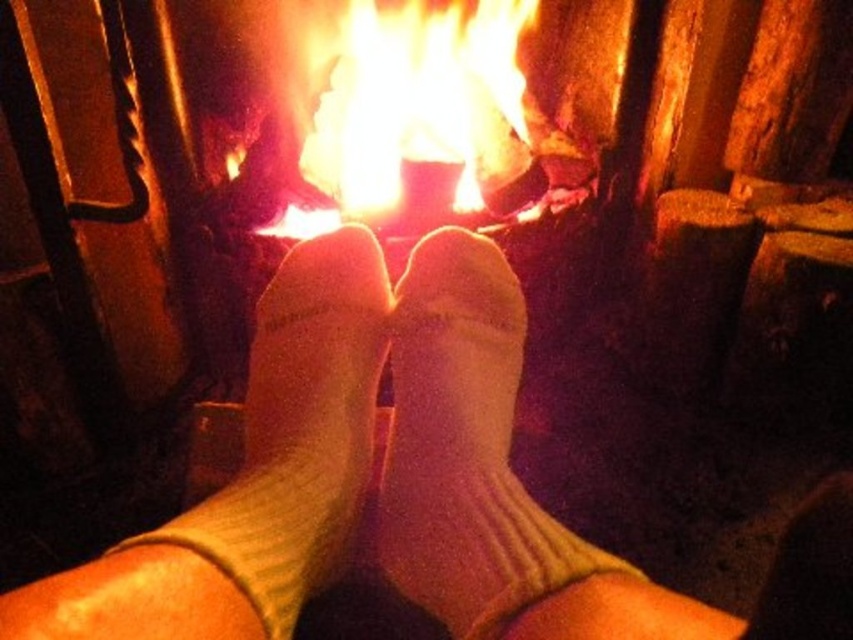
Question: Considering the real-world distances, which object is farthest from the white knit socks at center?

Choices:
 (A) white ribbed sock at center
 (B) white ribbed socks at center

Answer: (A)

Question: Is white ribbed socks at center positioned before white ribbed sock at center?

Choices:
 (A) no
 (B) yes

Answer: (B)

Question: Can you confirm if white ribbed socks at center is wider than white ribbed sock at center?

Choices:
 (A) yes
 (B) no

Answer: (A)

Question: Does white ribbed socks at center appear on the left side of white knit socks at center?

Choices:
 (A) no
 (B) yes

Answer: (B)

Question: Considering the real-world distances, which object is farthest from the white knit socks at center?

Choices:
 (A) white ribbed sock at center
 (B) white ribbed socks at center

Answer: (A)

Question: Among these objects, which one is nearest to the camera?

Choices:
 (A) white ribbed sock at center
 (B) white knit socks at center
 (C) white ribbed socks at center

Answer: (C)